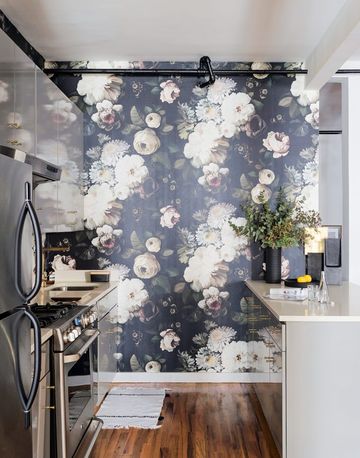
The height and width of the screenshot is (458, 360). What are the coordinates of `oven cooker` in the screenshot? It's located at (58, 340).